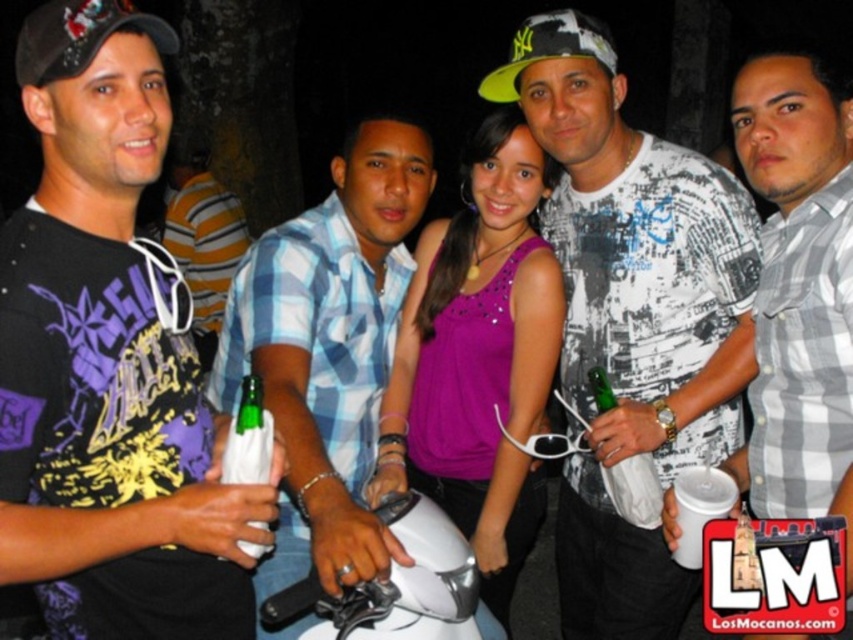
Is white matte motorcycle at center taller than striped shirt at center?

Incorrect, white matte motorcycle at center's height is not larger of striped shirt at center's.

Between point (461, 557) and point (165, 244), which one is positioned in front?

Point (461, 557) is in front.

Locate an element on the screen. Image resolution: width=853 pixels, height=640 pixels. white matte motorcycle at center is located at coordinates (399, 586).

Is neon yellow fabric baseball cap at center in front of green glass bottle at center?

No, it is behind green glass bottle at center.

Is neon yellow fabric baseball cap at center above green glass bottle at center?

Correct, neon yellow fabric baseball cap at center is located above green glass bottle at center.

Where is `neon yellow fabric baseball cap at center`? The height and width of the screenshot is (640, 853). neon yellow fabric baseball cap at center is located at coordinates (549, 49).

What do you see at coordinates (631, 314) in the screenshot?
I see `white printed shirt at center` at bounding box center [631, 314].

Does white printed shirt at center appear under gray checkered shirt at center?

Correct, white printed shirt at center is located below gray checkered shirt at center.

Looking at this image, who is more distant from viewer, (660,349) or (749,445)?

The point (660,349) is more distant.

At what (x,y) coordinates should I click in order to perform the action: click on white printed shirt at center. Please return your answer as a coordinate pair (x, y). The width and height of the screenshot is (853, 640). Looking at the image, I should click on (631, 314).